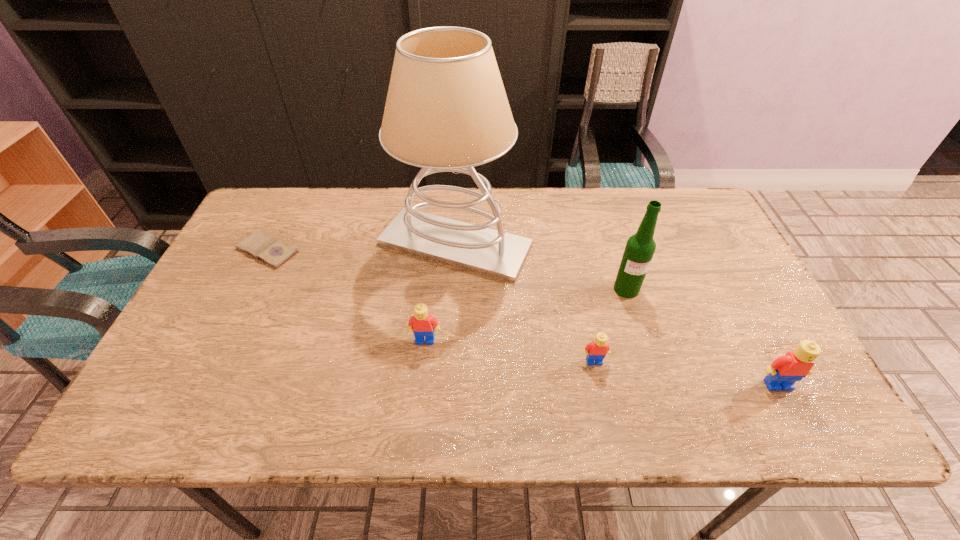
Please point a spot on the left to add another Lego. Please provide its 2D coordinates. Your answer should be formatted as a tuple, i.e. [(x, y)], where the tuple contains the x and y coordinates of a point satisfying the conditions above.

[(269, 321)]